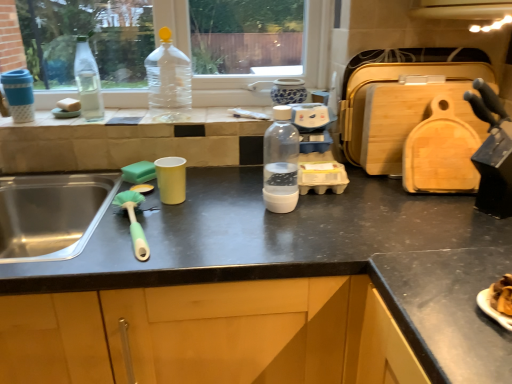
Find the location of a particular element. The width and height of the screenshot is (512, 384). vacant area that is in front of white sponge at left, placed as the first food when sorted from back to front is located at coordinates (52, 122).